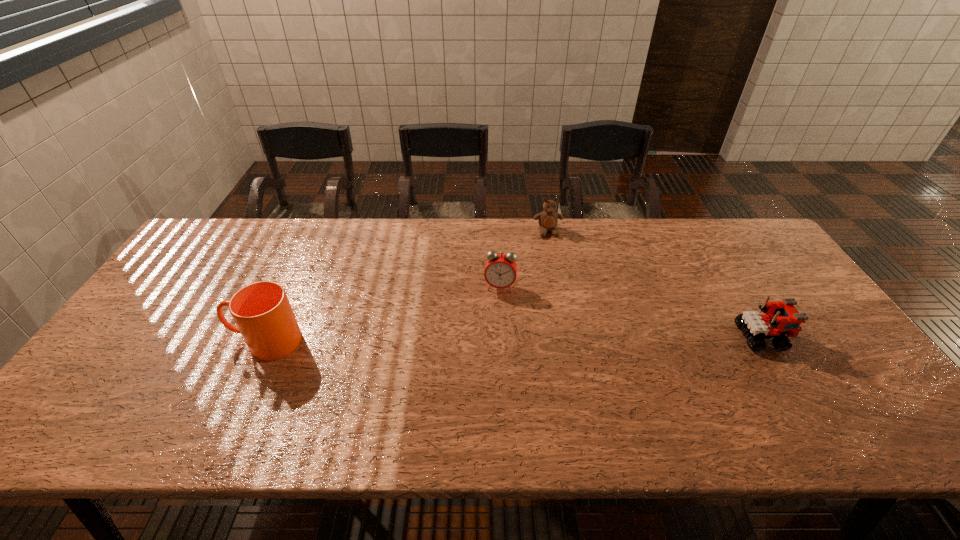
You are a GUI agent. You are given a task and a screenshot of the screen. Output one action in this format:
    pyautogui.click(x=<x>, y=<y>)
    Task: Click on the vacant area at the near edge
    
    Given the screenshot: What is the action you would take?
    pyautogui.click(x=519, y=401)

In the image, there is a desktop. Where is `free space at the right edge`? free space at the right edge is located at coordinates (770, 300).

Locate an element on the screen. The width and height of the screenshot is (960, 540). blank area at the far left corner is located at coordinates (195, 242).

Where is `vacant area at the far right corner`? vacant area at the far right corner is located at coordinates pyautogui.click(x=739, y=247).

In order to click on free space between the Lego and the mug in this screenshot , I will do `click(514, 340)`.

This screenshot has height=540, width=960. Find the location of `empty location between the leftmost object and the farthest object`. empty location between the leftmost object and the farthest object is located at coordinates (407, 287).

At what (x,y) coordinates should I click in order to perform the action: click on free point between the Lego and the alarm clock. Please return your answer as a coordinate pair (x, y). The width and height of the screenshot is (960, 540). Looking at the image, I should click on (632, 312).

Image resolution: width=960 pixels, height=540 pixels. In order to click on vacant area between the tallest object and the Lego in this screenshot , I will do [514, 340].

What are the coordinates of `vacant area that lies between the Lego and the tallest object` in the screenshot? It's located at (514, 340).

Find the location of a particular element. This screenshot has width=960, height=540. vacant space that's between the Lego and the tallest object is located at coordinates (514, 340).